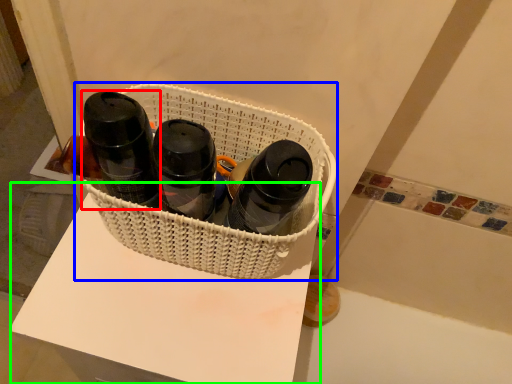
Question: Which object is the closest to the bottle (highlighted by a red box)? Choose among these: basket (highlighted by a blue box) or table (highlighted by a green box).

Choices:
 (A) basket
 (B) table

Answer: (A)